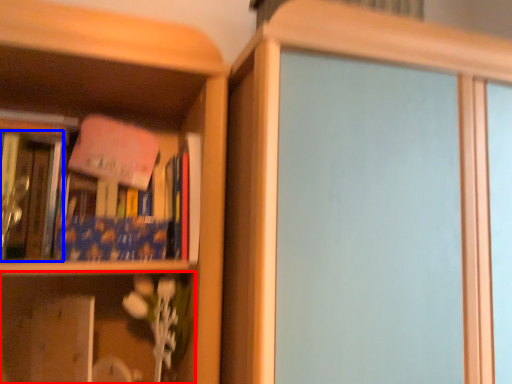
Question: Which point is further to the camera, shelf (highlighted by a red box) or book (highlighted by a blue box)?

Choices:
 (A) shelf
 (B) book

Answer: (B)